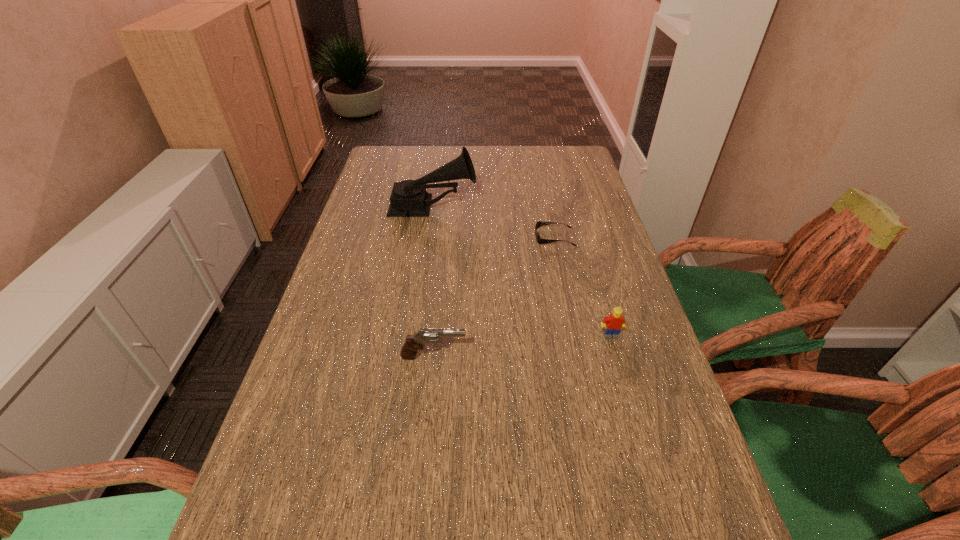
This screenshot has width=960, height=540. I want to click on the third closest object relative to the Lego, so coord(409,198).

In order to click on free space that satisfies the following two spatial constraints: 1. on the front-facing side of the Lego; 2. at the barrel of the pistol in this screenshot , I will do `click(617, 357)`.